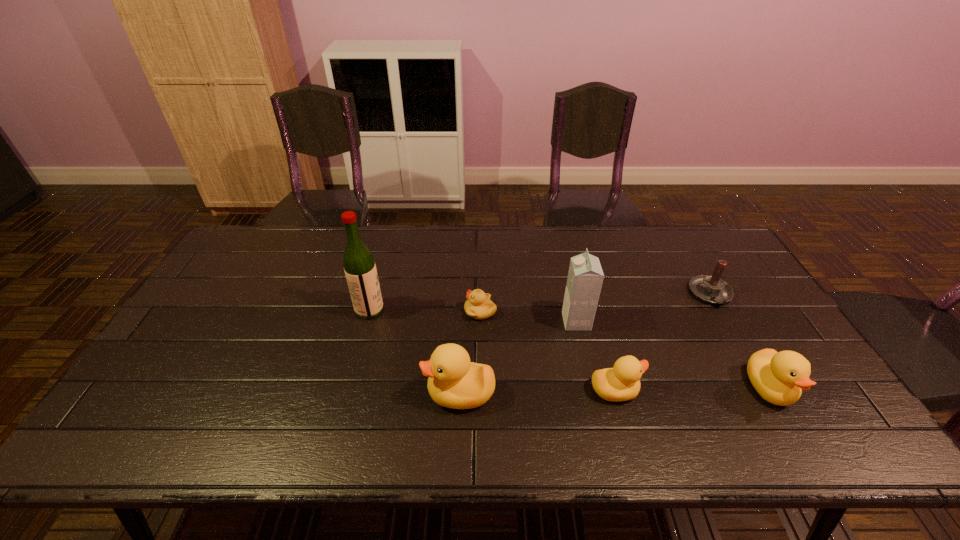
Identify the location of free space at the far edge of the desktop. This screenshot has width=960, height=540. (625, 230).

In the image, there is a desktop. Where is `free space at the near edge`? This screenshot has height=540, width=960. free space at the near edge is located at coordinates pyautogui.click(x=649, y=408).

I want to click on vacant region at the far right corner, so click(723, 246).

I want to click on vacant point located between the farthest duckling and the second tallest object, so click(x=528, y=316).

Image resolution: width=960 pixels, height=540 pixels. Identify the location of empty location between the second tallest duckling and the second duckling from right to left. (692, 389).

You are a GUI agent. You are given a task and a screenshot of the screen. Output one action in this format:
    pyautogui.click(x=<x>, y=<y>)
    Task: Click on the vacant area between the candle and the carton
    The image size is (960, 540).
    Given the screenshot: What is the action you would take?
    pyautogui.click(x=643, y=308)

Locate an element on the screen. vacant area between the farthest duckling and the sixth shortest object is located at coordinates (528, 316).

Image resolution: width=960 pixels, height=540 pixels. I want to click on empty space that is in between the third shortest duckling and the carton, so click(673, 354).

Locate an element on the screen. Image resolution: width=960 pixels, height=540 pixels. free area in between the candle and the third duckling from left to right is located at coordinates (662, 342).

You are a GUI agent. You are given a task and a screenshot of the screen. Output one action in this format:
    pyautogui.click(x=<x>, y=<y>)
    Task: Click on the empty space between the third tallest duckling and the shortest duckling
    The height and width of the screenshot is (540, 960).
    Given the screenshot: What is the action you would take?
    pyautogui.click(x=548, y=350)